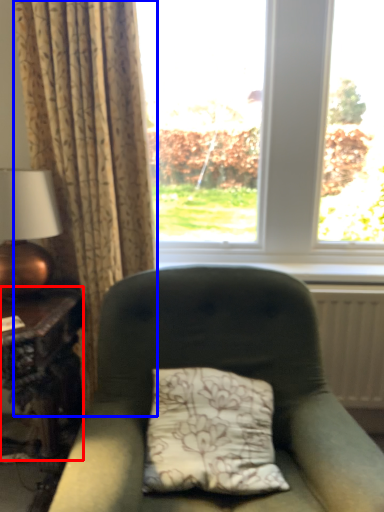
Question: Which of the following is the closest to the observer, table (highlighted by a red box) or curtain (highlighted by a blue box)?

Choices:
 (A) table
 (B) curtain

Answer: (A)